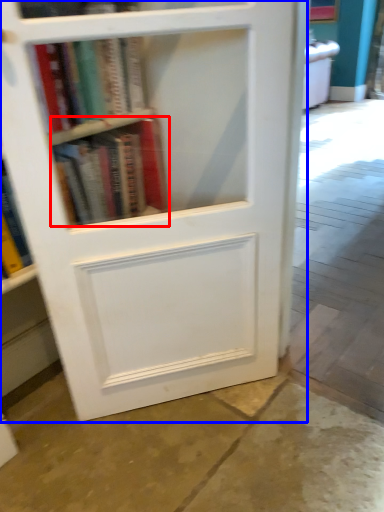
Question: Which point is closer to the camera, book (highlighted by a red box) or bookcase (highlighted by a blue box)?

Choices:
 (A) book
 (B) bookcase

Answer: (B)